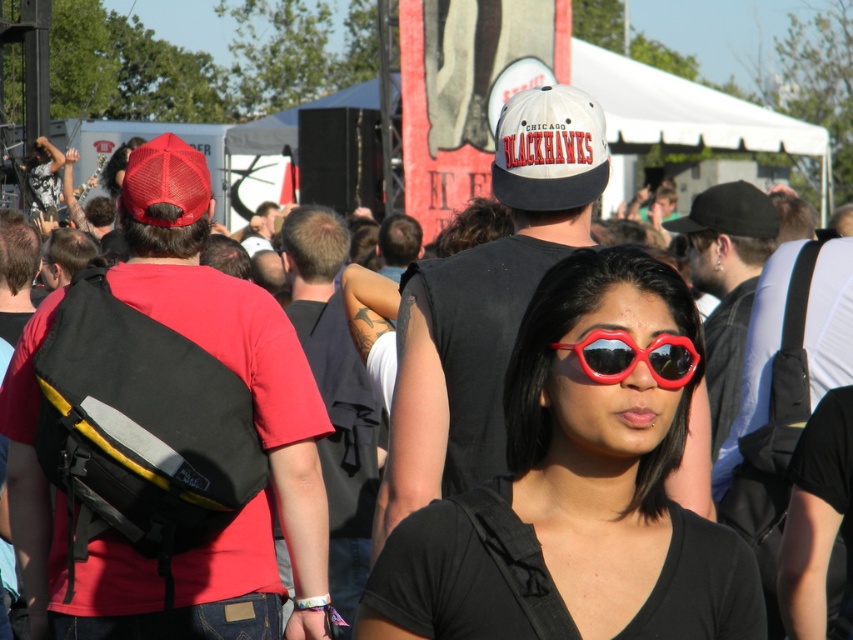
You are a photographer at the music festival scene. You want to capture a closeup shot of the shiny plastic sunglasses at center. Considering your camera lens has a minimum focusing distance of 2 meters, will you be able to take the photo without moving closer?

The shiny plastic sunglasses at center is 28.21 meters away from camera. Since the minimum focusing distance is 2 meters, the photographer can take the photo as the distance is sufficient.